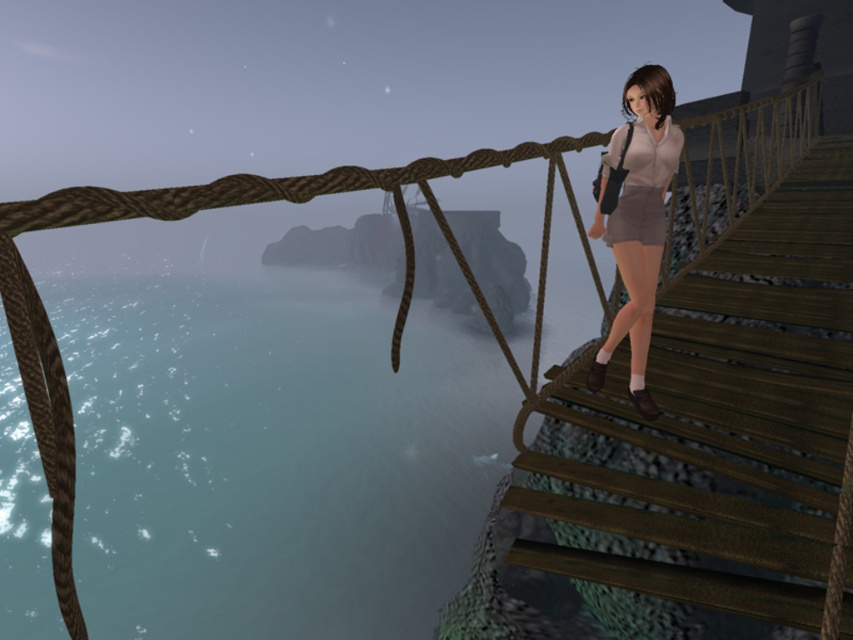
How much distance is there between translucent blue water at lower left and matte gray shorts at center?

translucent blue water at lower left is 45.72 meters away from matte gray shorts at center.

Between point (248, 616) and point (646, 74), which one is positioned behind?

The point (248, 616) is more distant.

This screenshot has height=640, width=853. I want to click on translucent blue water at lower left, so click(x=273, y=456).

Which is above, wooden stairs at right or matte gray shorts at center?

matte gray shorts at center is higher up.

Who is taller, wooden stairs at right or matte gray shorts at center?

wooden stairs at right

The height and width of the screenshot is (640, 853). I want to click on wooden stairs at right, so click(720, 426).

Between point (341, 285) and point (724, 458), which one is positioned behind?

Point (341, 285)

You are a GUI agent. You are given a task and a screenshot of the screen. Output one action in this format:
    pyautogui.click(x=<x>, y=<y>)
    Task: Click on the translucent blue water at lower left
    
    Given the screenshot: What is the action you would take?
    pyautogui.click(x=273, y=456)

At what (x,y) coordinates should I click in order to perform the action: click on translucent blue water at lower left. Please return your answer as a coordinate pair (x, y). Looking at the image, I should click on (273, 456).